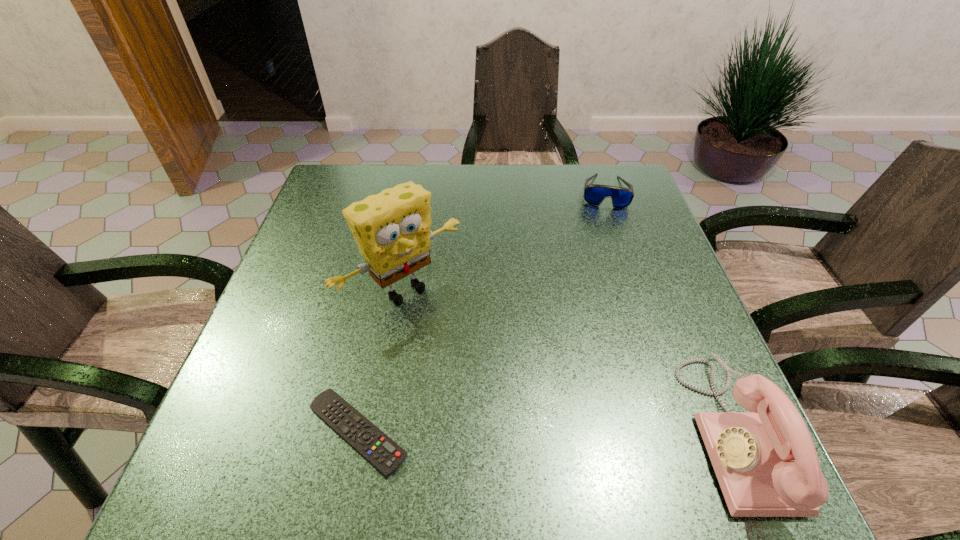
At what (x,y) coordinates should I click in order to perform the action: click on remote control. Please return your answer as a coordinate pair (x, y). Image resolution: width=960 pixels, height=540 pixels. Looking at the image, I should click on (385, 455).

The image size is (960, 540). I want to click on telephone, so click(765, 460).

Where is `sponge`? This screenshot has height=540, width=960. sponge is located at coordinates (392, 229).

Identify the location of the tallest object. (392, 229).

You are a GUI agent. You are given a task and a screenshot of the screen. Output one action in this format:
    pyautogui.click(x=<x>, y=<y>)
    Task: Click on the second shortest object
    
    Given the screenshot: What is the action you would take?
    pyautogui.click(x=594, y=194)

Locate an element on the screen. Image resolution: width=960 pixels, height=540 pixels. sunglasses is located at coordinates (594, 194).

Locate an element on the screen. Image resolution: width=960 pixels, height=540 pixels. vacant space located on the right of the remote control is located at coordinates (544, 432).

Locate an element on the screen. vacant region located 0.150m on the dial of the telephone is located at coordinates (608, 431).

Locate an element on the screen. free space located 0.160m on the dial of the telephone is located at coordinates (602, 431).

Image resolution: width=960 pixels, height=540 pixels. I want to click on vacant space situated on the dial of the telephone, so click(x=486, y=431).